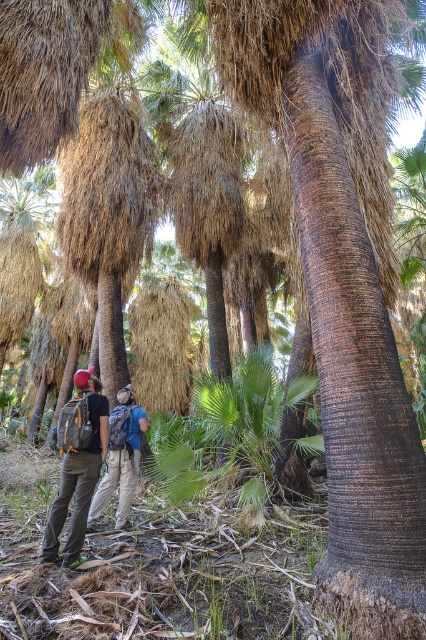
Can you confirm if matte gray backpack at center is positioned to the left of khaki pants at center?

Yes, matte gray backpack at center is to the left of khaki pants at center.

Consider the image. Is matte gray backpack at center wider than khaki pants at center?

Incorrect, matte gray backpack at center's width does not surpass khaki pants at center's.

Who is more distant from viewer, (83, 477) or (135, 410)?

The point (135, 410) is more distant.

Where is `matte gray backpack at center`? The height and width of the screenshot is (640, 426). matte gray backpack at center is located at coordinates (77, 467).